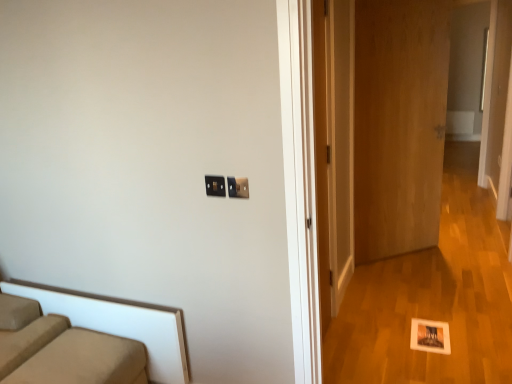
Question: Which direction should I rotate to look at matte black switch at upper center, the first electric outlet positioned from the right, — up or down?

Choices:
 (A) up
 (B) down

Answer: (A)

Question: Is wooden door at center, which appears as the 2th door when viewed from the front, looking in the opposite direction of matte black switch at upper center, which ranks as the second electric outlet in left-to-right order?

Choices:
 (A) yes
 (B) no

Answer: (B)

Question: Does wooden door at center, which is counted as the first door, starting from the right, have a lesser height compared to matte black switch at upper center, which ranks as the second electric outlet in left-to-right order?

Choices:
 (A) yes
 (B) no

Answer: (B)

Question: Is wooden door at center, the 2th door positioned from the left, directly adjacent to matte black switch at upper center, the first electric outlet positioned from the right?

Choices:
 (A) yes
 (B) no

Answer: (B)

Question: From a real-world perspective, is wooden door at center, which is counted as the first door, starting from the right, positioned over matte black switch at upper center, the first electric outlet positioned from the right, based on gravity?

Choices:
 (A) no
 (B) yes

Answer: (A)

Question: From a real-world perspective, is wooden door at center, which is counted as the first door, starting from the right, under matte black switch at upper center, the first electric outlet positioned from the right?

Choices:
 (A) yes
 (B) no

Answer: (A)

Question: Can you confirm if wooden door at center, the 2th door positioned from the left, is taller than matte black switch at upper center, which ranks as the second electric outlet in left-to-right order?

Choices:
 (A) yes
 (B) no

Answer: (A)

Question: From the image's perspective, is matte black switch at upper center, the first electric outlet positioned from the right, under black plastic electric outlet at center, the second electric outlet viewed from the right?

Choices:
 (A) no
 (B) yes

Answer: (B)

Question: Is matte black switch at upper center, the first electric outlet positioned from the right, in contact with black plastic electric outlet at center, the 1th electric outlet when ordered from left to right?

Choices:
 (A) yes
 (B) no

Answer: (A)

Question: From a real-world perspective, is matte black switch at upper center, the first electric outlet positioned from the right, over black plastic electric outlet at center, the second electric outlet viewed from the right?

Choices:
 (A) yes
 (B) no

Answer: (B)

Question: Can you confirm if matte black switch at upper center, which ranks as the second electric outlet in left-to-right order, is thinner than black plastic electric outlet at center, the second electric outlet viewed from the right?

Choices:
 (A) yes
 (B) no

Answer: (B)

Question: From the image's perspective, is matte black switch at upper center, which ranks as the second electric outlet in left-to-right order, located above black plastic electric outlet at center, the 1th electric outlet when ordered from left to right?

Choices:
 (A) no
 (B) yes

Answer: (A)

Question: Is matte black switch at upper center, which ranks as the second electric outlet in left-to-right order, at the left side of black plastic electric outlet at center, the second electric outlet viewed from the right?

Choices:
 (A) yes
 (B) no

Answer: (B)

Question: Considering the relative sizes of wooden door at right, which is the 1th door in front-to-back order, and wooden door at center, which appears as the 2th door when viewed from the front, in the image provided, is wooden door at right, which is the 1th door in front-to-back order, thinner than wooden door at center, which appears as the 2th door when viewed from the front,?

Choices:
 (A) no
 (B) yes

Answer: (B)